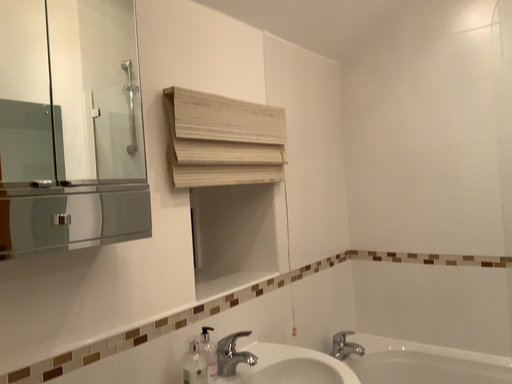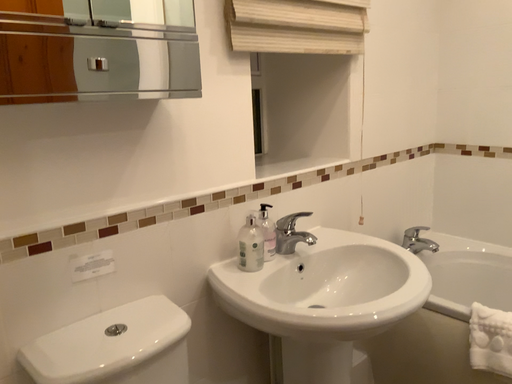
Question: Which way did the camera rotate in the video?

Choices:
 (A) rotated left
 (B) rotated right

Answer: (A)